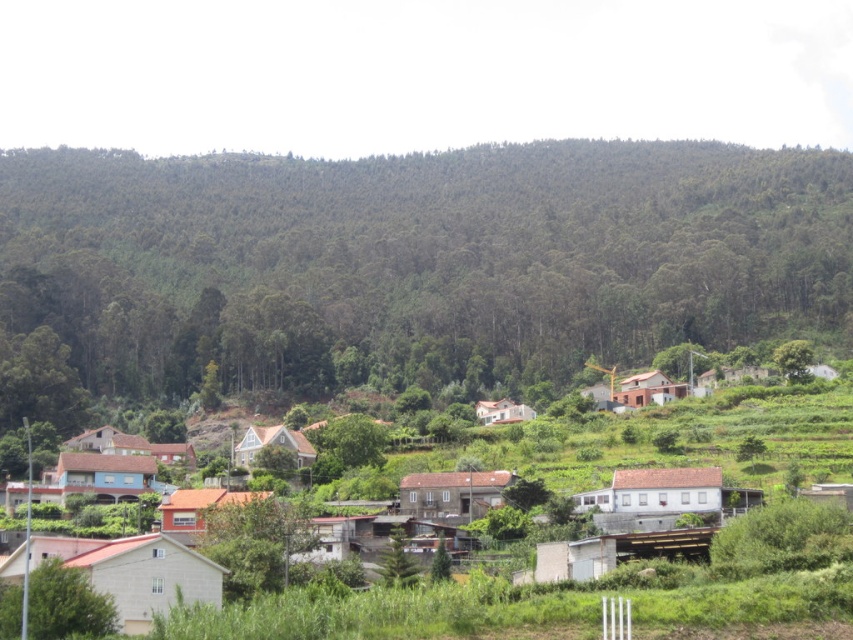
Question: Which object is closer to the camera taking this photo?

Choices:
 (A) white matte house at center
 (B) white wooden house at center

Answer: (B)

Question: Is white brick house at lower left to the right of white wooden house at center from the viewer's perspective?

Choices:
 (A) yes
 (B) no

Answer: (B)

Question: Which object appears closest to the camera in this image?

Choices:
 (A) orange matte house at lower left
 (B) brown stone house at center
 (C) white matte house at center

Answer: (A)

Question: Which of these objects is positioned closest to the light brown wooden house at lower left?

Choices:
 (A) brown stone house at center
 (B) white matte house at center
 (C) white matte houses at center
 (D) white brick house at lower left

Answer: (B)

Question: Does blue painted wooden house at lower left have a smaller size compared to white matte house at center?

Choices:
 (A) yes
 (B) no

Answer: (B)

Question: Can you confirm if white matte houses at center is thinner than orange matte house at lower left?

Choices:
 (A) yes
 (B) no

Answer: (B)